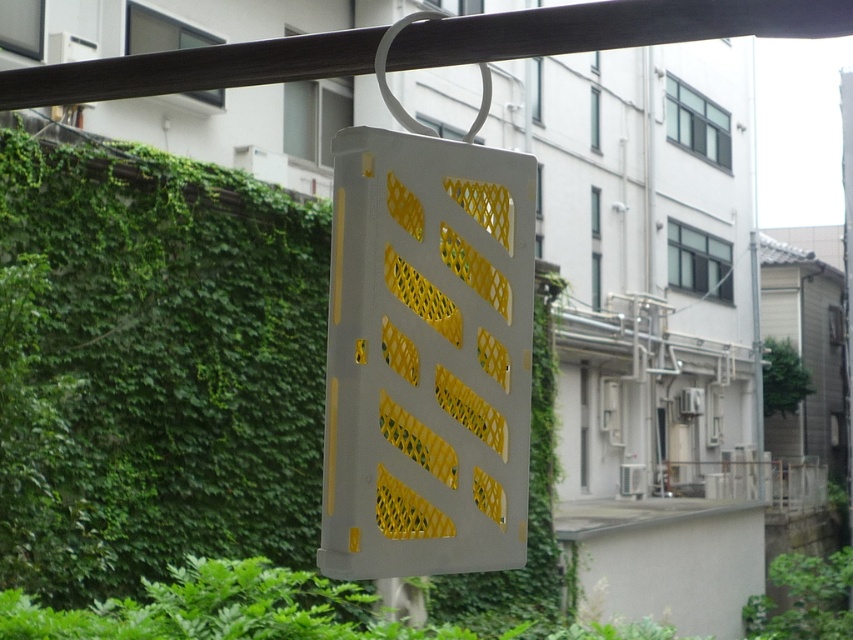
You are standing in front of the image and notice the green ivy at center. Can you determine its exact position using the coordinate system provided?

The green ivy at center is located at point coordinates of (154, 368).

You are standing at the base of the building and want to place a new plant pot between the green ivy at center and the white plastic mesh at center. The plant pot requires 1 meter of space. Is there enough space between them to place the plant pot?

The green ivy at center is 9.32 meters from the white plastic mesh at center, so there is more than enough space to place the plant pot requiring 1 meter of space between them.

From the picture: You are standing in front of the image and want to touch both points, point (194, 266) and point (494, 490). Which point should you reach for first to touch the one closer to you?

Point (194, 266) is closer to you, so you should reach for it first.